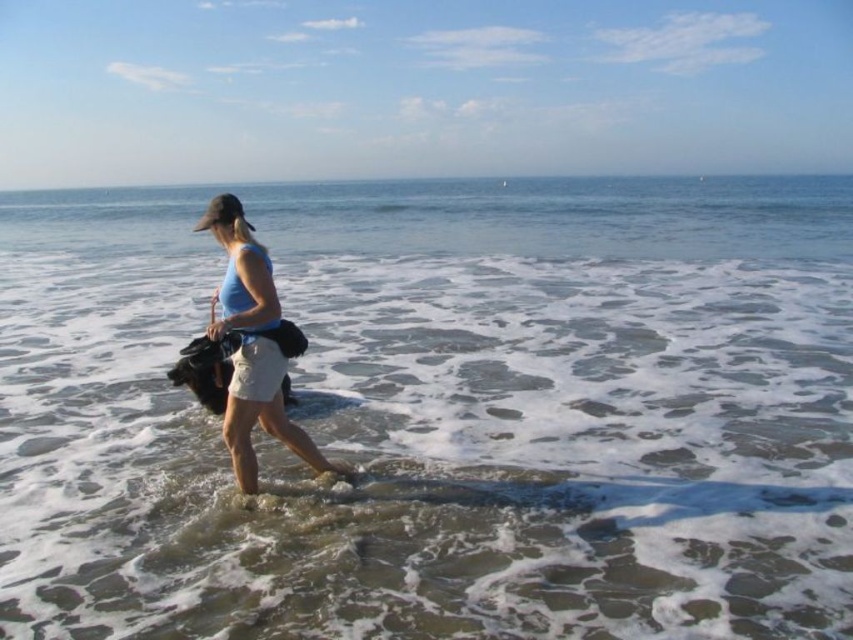
Question: Which point is closer to the camera?

Choices:
 (A) (262, 372)
 (B) (39, 204)
 (C) (256, 307)

Answer: (C)

Question: Which of the following is the farthest from the observer?

Choices:
 (A) blue fabric shorts at center
 (B) clear water at center
 (C) light beige cotton skirt at center

Answer: (A)

Question: Estimate the real-world distances between objects in this image. Which object is closer to the blue fabric shorts at center?

Choices:
 (A) clear water at center
 (B) light beige cotton skirt at center

Answer: (B)

Question: Where is blue fabric shorts at center located in relation to light beige cotton skirt at center in the image?

Choices:
 (A) left
 (B) right

Answer: (B)

Question: Can you confirm if blue fabric shorts at center is wider than light beige cotton skirt at center?

Choices:
 (A) yes
 (B) no

Answer: (A)

Question: Can you confirm if blue fabric shorts at center is bigger than light beige cotton skirt at center?

Choices:
 (A) yes
 (B) no

Answer: (A)